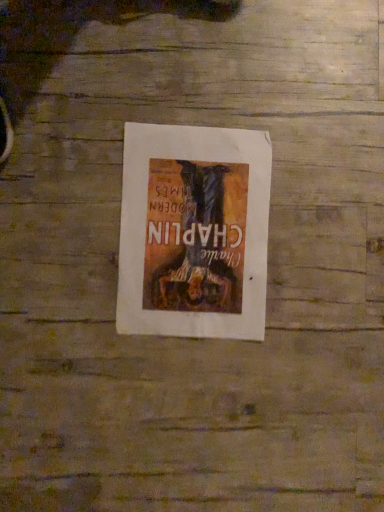
Locate an element on the screen. The image size is (384, 512). matte paper poster at center is located at coordinates (194, 232).

What do you see at coordinates (194, 232) in the screenshot? I see `matte paper poster at center` at bounding box center [194, 232].

The image size is (384, 512). Identify the location of matte paper poster at center. (194, 232).